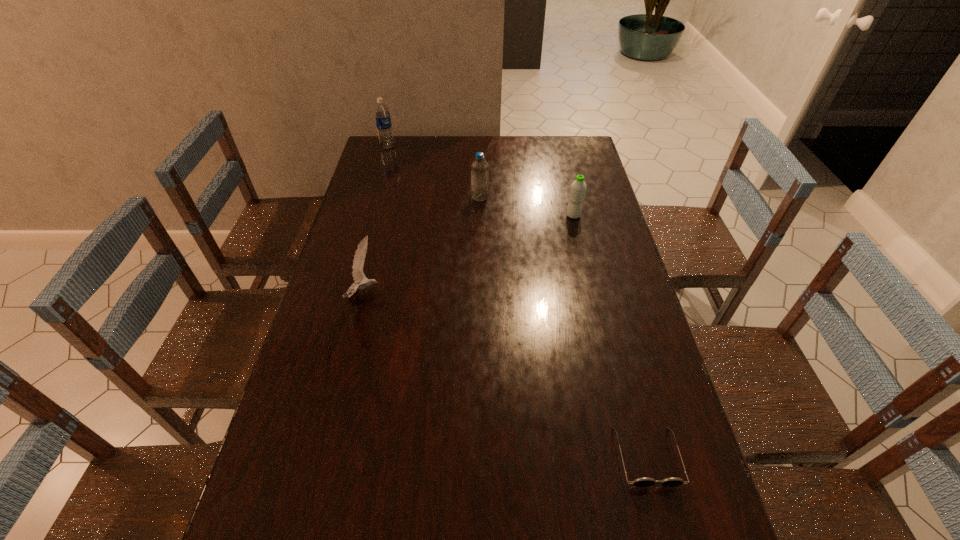
What are the coordinates of `free space located on the right of the farthest object` in the screenshot? It's located at (461, 147).

You are a GUI agent. You are given a task and a screenshot of the screen. Output one action in this format:
    pyautogui.click(x=<x>, y=<y>)
    Task: Click on the vacant space located on the right of the second farthest water bottle
    
    Given the screenshot: What is the action you would take?
    [529, 197]

Identify the location of vacant space located on the left of the third farthest object. The height and width of the screenshot is (540, 960). (549, 215).

The height and width of the screenshot is (540, 960). Identify the location of vacant area situated 0.320m at the tip of the beak of the gull. click(x=492, y=294).

The image size is (960, 540). I want to click on vacant space situated on the front-facing side of the sunglasses, so coord(663,521).

I want to click on object located in the far edge section of the desktop, so click(382, 114).

What are the coordinates of `water bottle positioned at the left edge` in the screenshot? It's located at (382, 114).

The height and width of the screenshot is (540, 960). Find the location of `gull that is at the left edge`. gull that is at the left edge is located at coordinates (359, 258).

The height and width of the screenshot is (540, 960). I want to click on water bottle present at the right edge, so click(578, 188).

At what (x,y) coordinates should I click in order to perform the action: click on sunglasses located in the right edge section of the desktop. Please return your answer as a coordinate pair (x, y). The image size is (960, 540). Looking at the image, I should click on (640, 482).